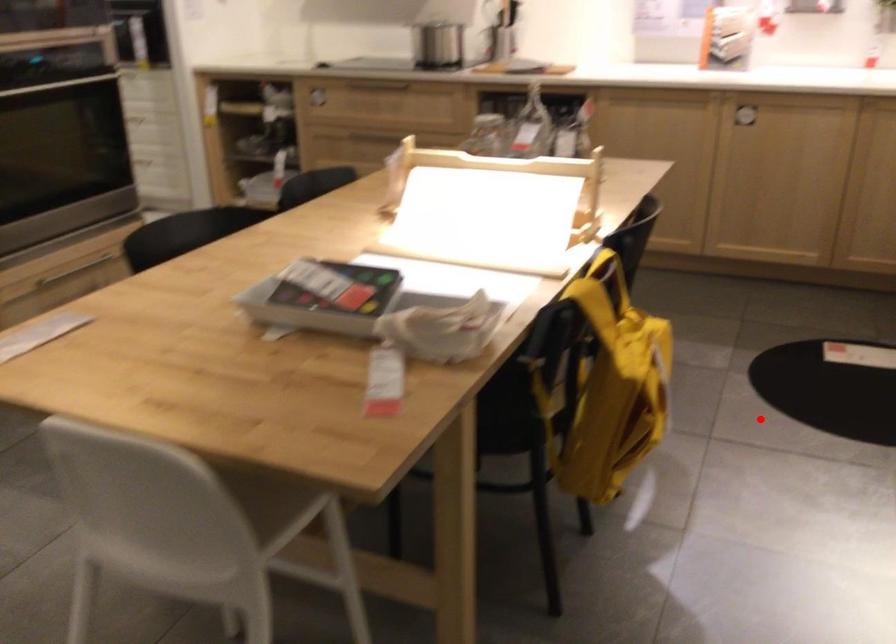
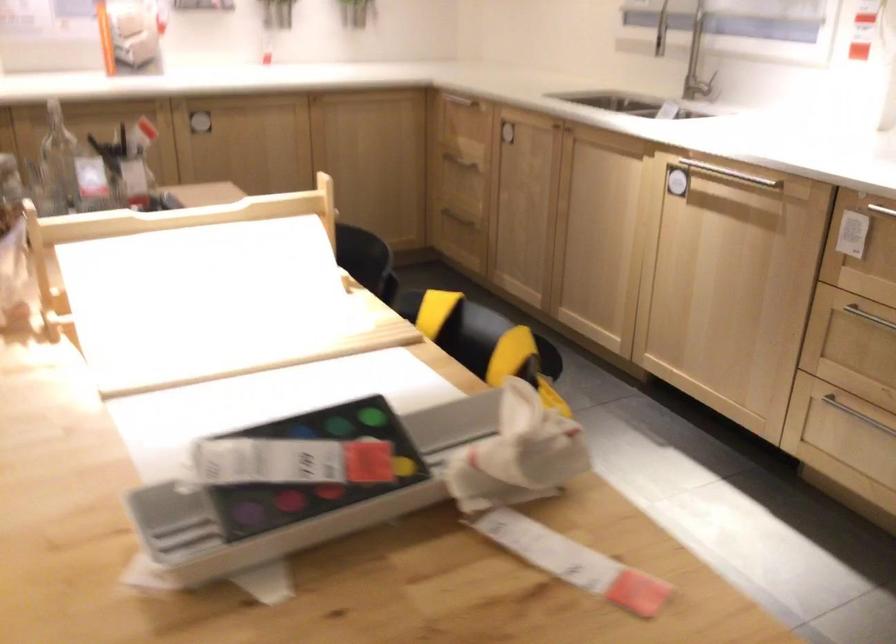
Question: I am providing you with two images of the same scene from different viewpoints. A red point is marked on the first image. At the location where the point appears in image 1, is it still visible in image 2?

Choices:
 (A) Yes
 (B) No

Answer: (B)